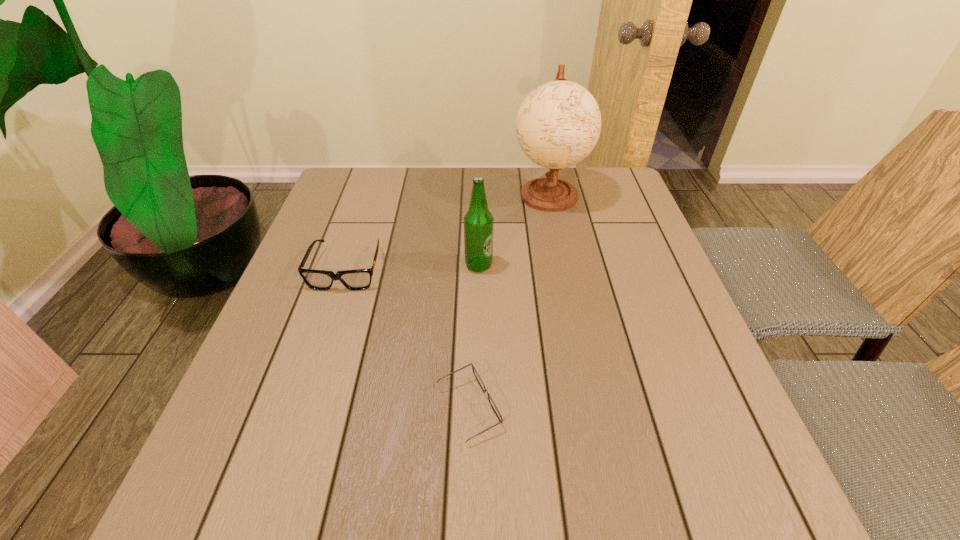
Find the location of a particular element. This screenshot has height=540, width=960. free spot located with the lenses facing outward on the nearest object is located at coordinates (553, 409).

At what (x,y) coordinates should I click in order to perform the action: click on object that is at the far edge. Please return your answer as a coordinate pair (x, y). Looking at the image, I should click on (558, 124).

Locate an element on the screen. object positioned at the left edge is located at coordinates (360, 279).

This screenshot has height=540, width=960. I want to click on object that is positioned at the right edge, so click(x=558, y=124).

Locate an element on the screen. object at the far right corner is located at coordinates (558, 124).

The height and width of the screenshot is (540, 960). I want to click on vacant space at the far edge of the desktop, so click(x=447, y=168).

You are a GUI agent. You are given a task and a screenshot of the screen. Output one action in this format:
    pyautogui.click(x=<x>, y=<y>)
    Task: Click on the vacant space at the near edge of the desktop
    Image resolution: width=960 pixels, height=540 pixels.
    Given the screenshot: What is the action you would take?
    coord(575,519)

In the image, there is a desktop. Where is `vacant area at the left edge`? The height and width of the screenshot is (540, 960). vacant area at the left edge is located at coordinates (263, 340).

Find the location of a particular element. vacant region at the right edge of the desktop is located at coordinates (667, 303).

Locate an element on the screen. The image size is (960, 540). vacant space at the far left corner of the desktop is located at coordinates (357, 172).